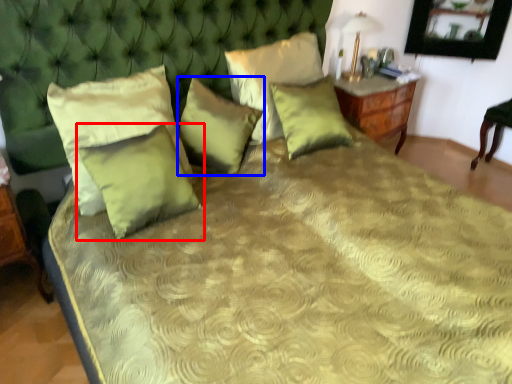
Question: Which object appears closest to the camera in this image, pillow (highlighted by a red box) or pillow (highlighted by a blue box)?

Choices:
 (A) pillow
 (B) pillow

Answer: (A)